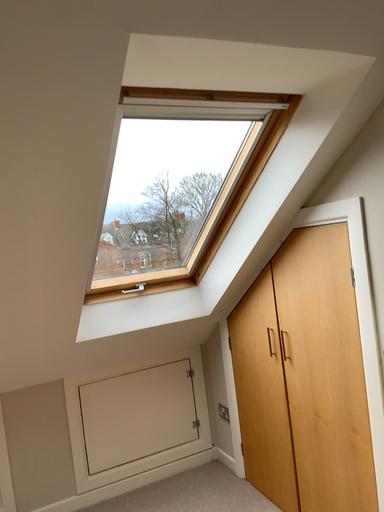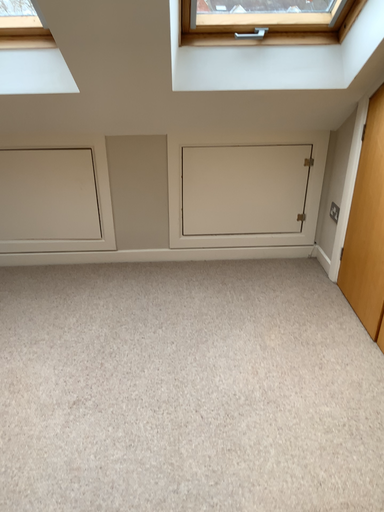
Question: Which way did the camera rotate in the video?

Choices:
 (A) rotated downward
 (B) rotated upward

Answer: (A)